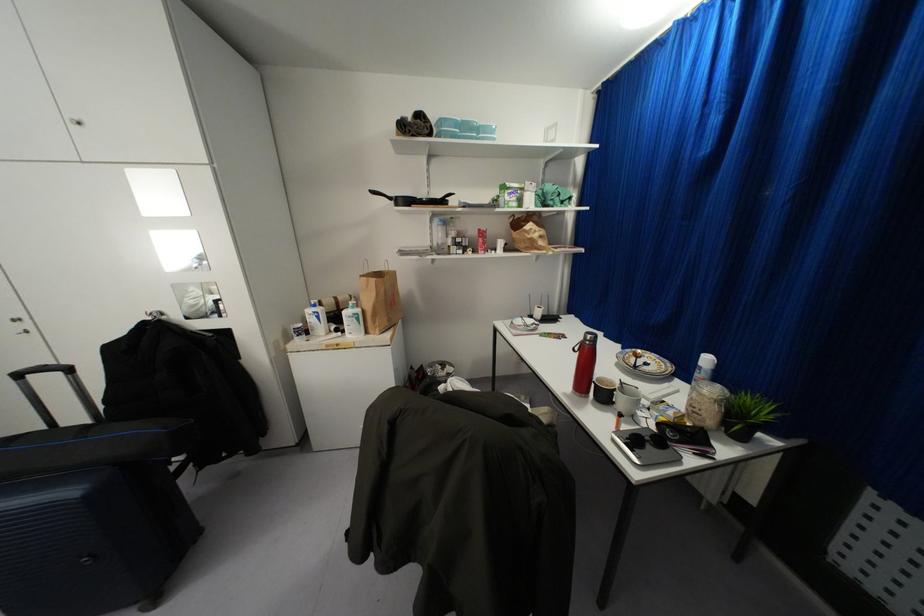
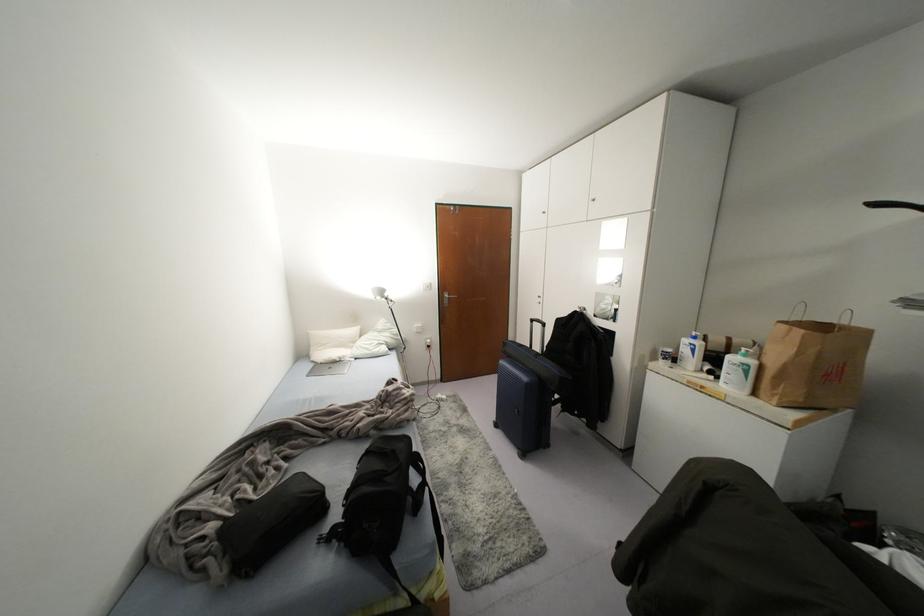
Question: The camera is either moving clockwise (left) or counter-clockwise (right) around the object. The first image is from the beginning of the video and the second image is from the end. Is the camera moving left or right when shooting the video?

Choices:
 (A) Left
 (B) Right

Answer: (B)